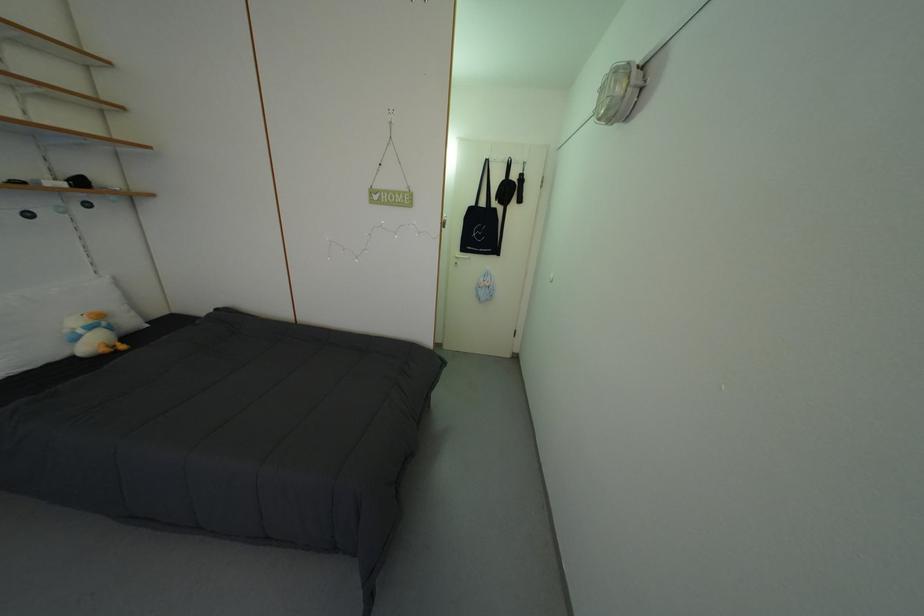
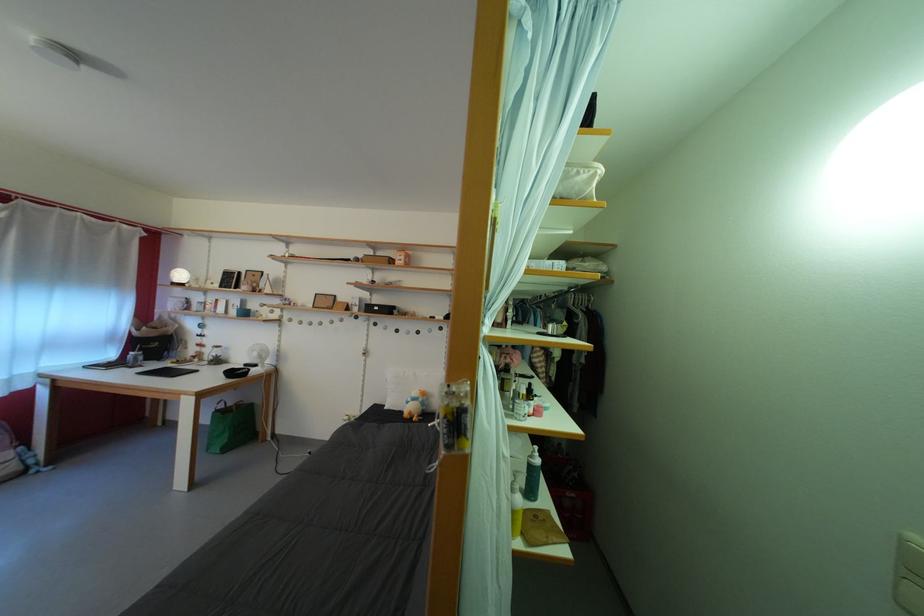
The point at (90, 338) is marked in the first image. Where is the corresponding point in the second image?

(418, 405)